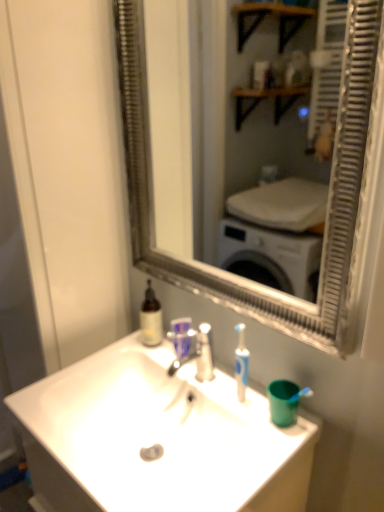
Locate an element on the screen. The width and height of the screenshot is (384, 512). translucent plastic mouthwash at center is located at coordinates (181, 335).

The height and width of the screenshot is (512, 384). What do you see at coordinates (68, 169) in the screenshot?
I see `white glossy glass door at left` at bounding box center [68, 169].

Measure the distance between point (56, 179) and camera.

They are 3.83 feet apart.

Where is `translucent glass bottle at upper left`? Image resolution: width=384 pixels, height=512 pixels. translucent glass bottle at upper left is located at coordinates (151, 318).

Identify the location of liquid above the silver metallic faucet at center (from a real-world perspective). coord(151,318).

From the image's perspective, is silver metallic faucet at center located above or below translucent glass bottle at upper left?

silver metallic faucet at center is situated lower than translucent glass bottle at upper left in the image.

Would you say silver metallic faucet at center is inside or outside translucent glass bottle at upper left?

silver metallic faucet at center is spatially situated outside translucent glass bottle at upper left.

In the scene shown: Can you confirm if silver metallic faucet at center is wider than translucent glass bottle at upper left?

Yes.

From the image's perspective, is silver metallic mirror at center located above or below translucent glass bottle at upper left?

silver metallic mirror at center is situated higher than translucent glass bottle at upper left in the image.

Considering the sizes of objects silver metallic mirror at center and translucent glass bottle at upper left in the image provided, who is taller, silver metallic mirror at center or translucent glass bottle at upper left?

With more height is silver metallic mirror at center.

Is point (166, 12) more distant than point (152, 329)?

No, (166, 12) is closer to viewer.

Which of these two, silver metallic mirror at center or white glossy sink at center, is bigger?

white glossy sink at center is bigger.

Based on the photo, considering the positions of objects silver metallic mirror at center and white glossy sink at center in the image provided, who is more to the left, silver metallic mirror at center or white glossy sink at center?

Positioned to the left is white glossy sink at center.

From the image's perspective, is silver metallic mirror at center under white glossy sink at center?

Actually, silver metallic mirror at center appears above white glossy sink at center in the image.

Is silver metallic mirror at center aimed at silver metallic faucet at center?

No, silver metallic mirror at center is not aimed at silver metallic faucet at center.

Considering the positions of points (183, 220) and (201, 375), is point (183, 220) farther from camera compared to point (201, 375)?

Yes, it is.

Between silver metallic mirror at center and silver metallic faucet at center, which one appears on the right side from the viewer's perspective?

Positioned to the right is silver metallic mirror at center.

Which object is further away from the camera taking this photo, white glossy glass door at left or silver metallic mirror at center?

Positioned behind is white glossy glass door at left.

Can you tell me how much white glossy glass door at left and silver metallic mirror at center differ in facing direction?

The facing directions of white glossy glass door at left and silver metallic mirror at center are 0.638 degrees apart.

Between white glossy glass door at left and silver metallic mirror at center, which one has smaller width?

Thinner between the two is silver metallic mirror at center.

Considering the relative positions of white glossy sink at center and silver metallic faucet at center in the image provided, is white glossy sink at center behind silver metallic faucet at center?

No, white glossy sink at center is closer to the viewer.

Is white glossy sink at center to the right of silver metallic faucet at center from the viewer's perspective?

No, white glossy sink at center is not to the right of silver metallic faucet at center.

Can you confirm if white glossy sink at center is wider than silver metallic faucet at center?

Yes, white glossy sink at center is wider than silver metallic faucet at center.

Visually, is translucent glass bottle at upper left positioned to the left or to the right of white glossy glass door at left?

From the image, it's evident that translucent glass bottle at upper left is to the right of white glossy glass door at left.

Is point (159, 327) behind point (54, 187)?

Yes, point (159, 327) is farther from viewer.

From a real-world perspective, is translucent glass bottle at upper left under white glossy glass door at left?

Yes, from a real-world perspective, translucent glass bottle at upper left is beneath white glossy glass door at left.

Find the location of a particular element. liquid located underneath the white glossy glass door at left (from a real-world perspective) is located at coordinates (151, 318).

Where is `liquid behind the silver metallic faucet at center`? The height and width of the screenshot is (512, 384). liquid behind the silver metallic faucet at center is located at coordinates (151, 318).

In order to click on mirror that is above the translucent glass bottle at upper left (from a real-world perspective) in this screenshot , I will do `click(187, 121)`.

Based on their spatial positions, is white glossy glass door at left or silver metallic mirror at center closer to silver metallic faucet at center?

white glossy glass door at left lies closer to silver metallic faucet at center than the other object.

When comparing their distances from silver metallic mirror at center, does white glossy glass door at left or silver metallic faucet at center seem closer?

Based on the image, white glossy glass door at left appears to be nearer to silver metallic mirror at center.

When comparing their distances from white glossy sink at center, does translucent plastic mouthwash at center or silver metallic faucet at center seem further?

Among the two, translucent plastic mouthwash at center is located further to white glossy sink at center.

Which object lies nearer to the anchor point white glossy sink at center, white glossy glass door at left or silver metallic mirror at center?

white glossy glass door at left lies closer to white glossy sink at center than the other object.

When comparing their distances from silver metallic faucet at center, does translucent glass bottle at upper left or translucent plastic mouthwash at center seem closer?

translucent plastic mouthwash at center is positioned closer to the anchor silver metallic faucet at center.

From the image, which object appears to be nearer to translucent plastic mouthwash at center, silver metallic faucet at center or white glossy glass door at left?

silver metallic faucet at center.

From the picture: Looking at the image, which one is located further to white glossy sink at center, translucent plastic mouthwash at center or white glossy glass door at left?

white glossy glass door at left.

Which object lies further to the anchor point white glossy glass door at left, silver metallic mirror at center or silver metallic faucet at center?

The object further to white glossy glass door at left is silver metallic mirror at center.

Find the location of a particular element. liquid between white glossy glass door at left and translucent plastic mouthwash at center in the horizontal direction is located at coordinates (151, 318).

Locate an element on the screen. The height and width of the screenshot is (512, 384). tap between silver metallic mirror at center and translucent plastic mouthwash at center along the z-axis is located at coordinates click(198, 355).

Identify the location of glass door located between silver metallic mirror at center and translucent plastic mouthwash at center in the depth direction. (68, 169).

Where is `tap between silver metallic mirror at center and white glossy sink at center in the vertical direction`? This screenshot has width=384, height=512. tap between silver metallic mirror at center and white glossy sink at center in the vertical direction is located at coordinates (198, 355).